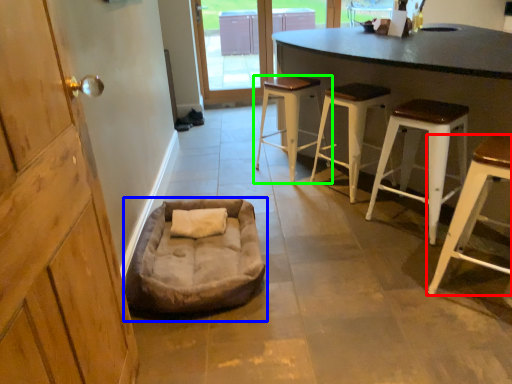
Question: Based on their relative distances, which object is farther from stool (highlighted by a red box)? Choose from dog bed (highlighted by a blue box) and stool (highlighted by a green box).

Choices:
 (A) dog bed
 (B) stool

Answer: (B)